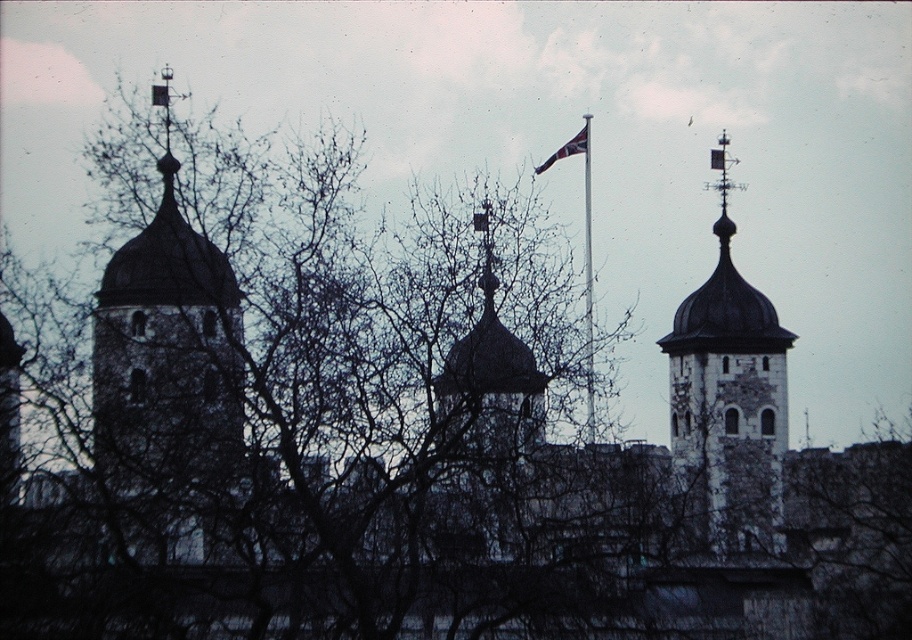
Is stone dome at upper center to the right of polished metal flag pole at center from the viewer's perspective?

Correct, you'll find stone dome at upper center to the right of polished metal flag pole at center.

The width and height of the screenshot is (912, 640). Find the location of `stone dome at upper center`. stone dome at upper center is located at coordinates (729, 396).

Where is `stone dome at upper center`? This screenshot has width=912, height=640. stone dome at upper center is located at coordinates (729, 396).

Is point (713, 433) positioned before point (570, 152)?

Yes.

What do you see at coordinates (729, 396) in the screenshot? I see `stone dome at upper center` at bounding box center [729, 396].

The image size is (912, 640). Describe the element at coordinates (729, 396) in the screenshot. I see `stone dome at upper center` at that location.

You are a GUI agent. You are given a task and a screenshot of the screen. Output one action in this format:
    pyautogui.click(x=<x>, y=<y>)
    Task: Click on the stone dome at upper center
    Image resolution: width=912 pixels, height=640 pixels.
    Given the screenshot: What is the action you would take?
    pyautogui.click(x=729, y=396)

Based on the photo, which of these two, polished metal flag pole at center or red flag at center, stands shorter?

red flag at center is shorter.

This screenshot has height=640, width=912. What do you see at coordinates (587, 273) in the screenshot?
I see `polished metal flag pole at center` at bounding box center [587, 273].

This screenshot has height=640, width=912. What do you see at coordinates (587, 273) in the screenshot? I see `polished metal flag pole at center` at bounding box center [587, 273].

The width and height of the screenshot is (912, 640). Identify the location of polished metal flag pole at center. (587, 273).